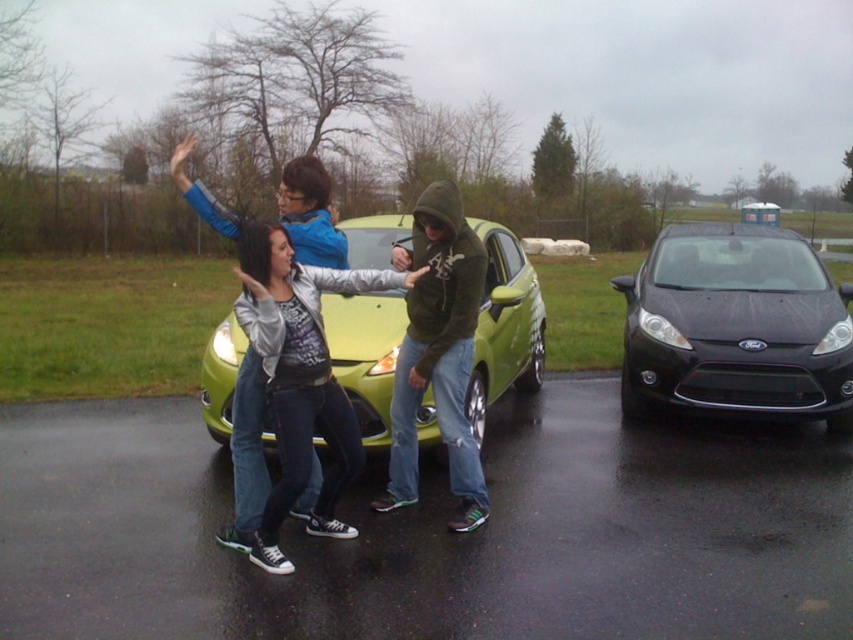
Which is above, denim jacket at center or dark green hoodie at center?

dark green hoodie at center is higher up.

Based on the photo, which of these two, denim jacket at center or dark green hoodie at center, stands shorter?

denim jacket at center is shorter.

I want to click on denim jacket at center, so click(300, 376).

Between green matte hatchback at center and denim jacket at center, which one appears on the right side from the viewer's perspective?

green matte hatchback at center

Is green matte hatchback at center further to the viewer compared to denim jacket at center?

Yes.

Is point (231, 330) more distant than point (299, 378)?

Yes, it is behind point (299, 378).

Locate an element on the screen. The width and height of the screenshot is (853, 640). green matte hatchback at center is located at coordinates (505, 324).

Which is behind, point (688, 340) or point (434, 264)?

Point (688, 340)

Which is more to the left, black matte ford fiesta at center or dark green hoodie at center?

Positioned to the left is dark green hoodie at center.

Is point (672, 266) positioned in front of point (479, 284)?

No, (672, 266) is further to viewer.

Where is `black matte ford fiesta at center`? The image size is (853, 640). black matte ford fiesta at center is located at coordinates (735, 326).